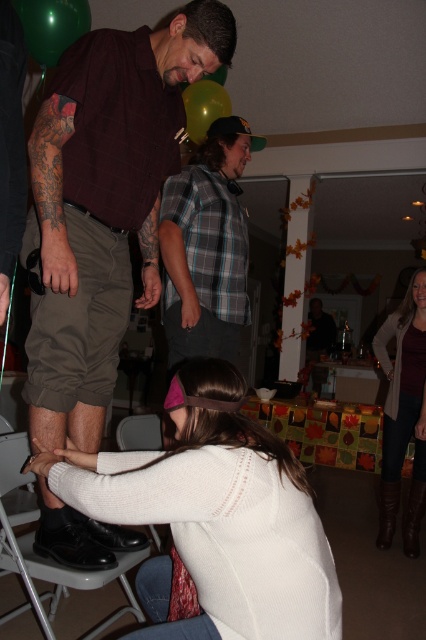
Question: Which point is closer to the camera taking this photo?

Choices:
 (A) (423, 515)
 (B) (291, 460)
 (C) (129, 52)
 (D) (198, 93)

Answer: (B)

Question: Can you confirm if matte black shoe at lower left is thinner than plaid shirt at center?

Choices:
 (A) yes
 (B) no

Answer: (B)

Question: Is matte black shoe at lower left bigger than black leather folding chair at lower center?

Choices:
 (A) no
 (B) yes

Answer: (B)

Question: Which is nearer to the plaid shirt at center?

Choices:
 (A) white knit sweater at lower center
 (B) matte black shoe at lower left
 (C) green rubber balloon at upper center
 (D) brown leather boots at lower right

Answer: (B)

Question: Based on their relative distances, which object is nearer to the black leather folding chair at lower center?

Choices:
 (A) green rubber balloon at upper center
 (B) white knit sweater at lower center
 (C) matte black shoe at lower left
 (D) green glossy balloon at upper left

Answer: (B)

Question: Is white knit sweater at lower center to the left of brown leather boots at lower right from the viewer's perspective?

Choices:
 (A) yes
 (B) no

Answer: (A)